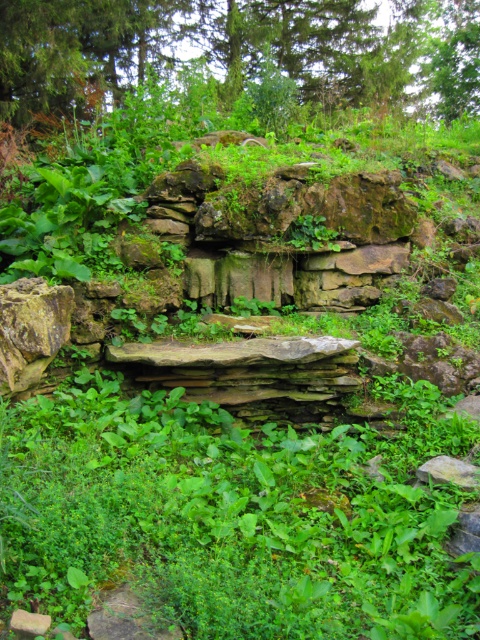
Can you confirm if green leafy grass at center is smaller than green leafy tree at upper center?

Incorrect, green leafy grass at center is not smaller in size than green leafy tree at upper center.

Can you confirm if green leafy grass at center is positioned above green leafy tree at upper center?

No.

Identify the location of green leafy grass at center. (232, 516).

Where is `green leafy grass at center`? green leafy grass at center is located at coordinates (232, 516).